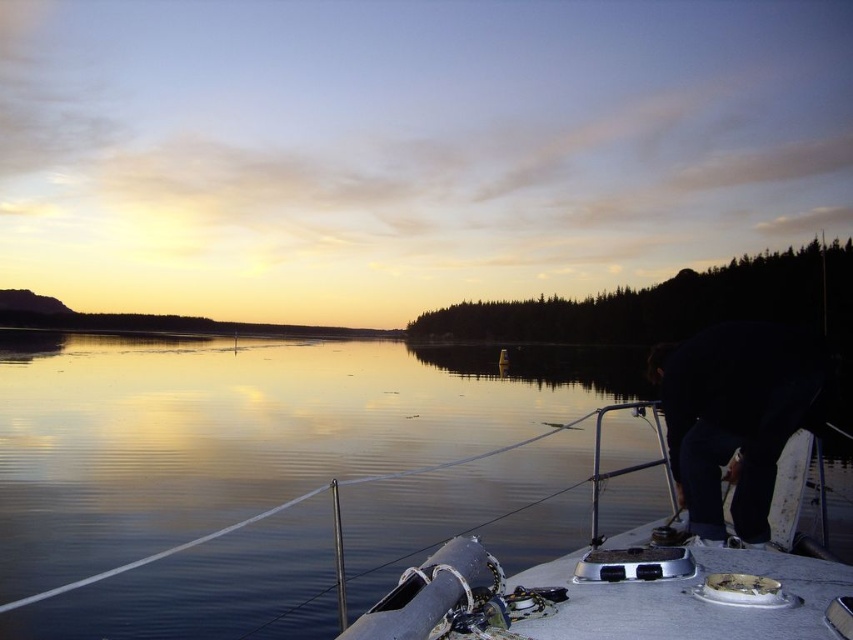
Is glossy reflective water at center to the right of dark blue jeans at lower right from the viewer's perspective?

No, glossy reflective water at center is not to the right of dark blue jeans at lower right.

Does glossy reflective water at center appear over dark blue jeans at lower right?

Actually, glossy reflective water at center is below dark blue jeans at lower right.

Is point (57, 401) in front of point (683, 500)?

No, it is not.

Where is `glossy reflective water at center`? Image resolution: width=853 pixels, height=640 pixels. glossy reflective water at center is located at coordinates (274, 474).

Looking at this image, who is shorter, glossy reflective water at center or metallic gray boat at lower right?

metallic gray boat at lower right is shorter.

Which is above, glossy reflective water at center or metallic gray boat at lower right?

metallic gray boat at lower right

What do you see at coordinates (274, 474) in the screenshot?
I see `glossy reflective water at center` at bounding box center [274, 474].

Where is `glossy reflective water at center`? The height and width of the screenshot is (640, 853). glossy reflective water at center is located at coordinates (274, 474).

Which is above, metallic gray boat at lower right or dark blue jeans at lower right?

dark blue jeans at lower right is above.

Does point (556, 563) come farther from viewer compared to point (792, 417)?

No, (556, 563) is closer to viewer.

Find the location of `metallic gray boat at lower right`. metallic gray boat at lower right is located at coordinates (630, 580).